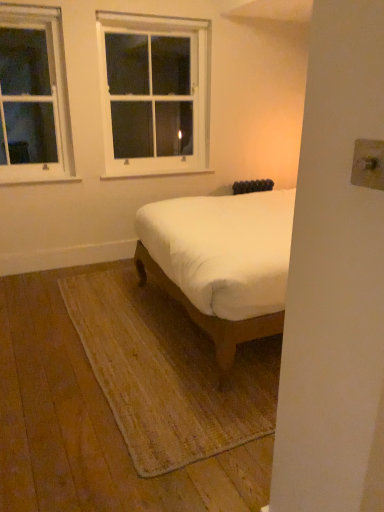
Image resolution: width=384 pixels, height=512 pixels. In order to click on white wood window at upper left, which is counted as the second window, starting from the right in this screenshot , I will do `click(34, 97)`.

Identify the location of white fabric bed at center. (221, 262).

Where is `white wood window at upper left, acting as the 1th window starting from the left`? Image resolution: width=384 pixels, height=512 pixels. white wood window at upper left, acting as the 1th window starting from the left is located at coordinates (34, 97).

Is white wood window at upper center, the first window from the right, facing away from white wood window at upper left, which is counted as the second window, starting from the right?

That's not correct — white wood window at upper center, the first window from the right, is not looking away from white wood window at upper left, which is counted as the second window, starting from the right.

I want to click on window behind the white wood window at upper left, acting as the 1th window starting from the left, so click(153, 93).

Can you confirm if white wood window at upper center, the 2th window positioned from the left, is shorter than white wood window at upper left, which is counted as the second window, starting from the right?

Incorrect, the height of white wood window at upper center, the 2th window positioned from the left, does not fall short of that of white wood window at upper left, which is counted as the second window, starting from the right.

Which object is further away from the camera taking this photo, white wood window at upper center, the first window from the right, or white wood window at upper left, which is counted as the second window, starting from the right?

Positioned behind is white wood window at upper center, the first window from the right.

Which object is positioned more to the left, white wood window at upper center, the 2th window positioned from the left, or white fabric bed at center?

From the viewer's perspective, white wood window at upper center, the 2th window positioned from the left, appears more on the left side.

Is white wood window at upper center, the 2th window positioned from the left, located outside white fabric bed at center?

Indeed, white wood window at upper center, the 2th window positioned from the left, is completely outside white fabric bed at center.

Locate an element on the screen. The height and width of the screenshot is (512, 384). window that is the 2nd object located behind the white fabric bed at center is located at coordinates (153, 93).

From a real-world perspective, relative to white fabric bed at center, is white wood window at upper center, the 2th window positioned from the left, vertically above or below?

Clearly, from a real-world perspective, white wood window at upper center, the 2th window positioned from the left, is above white fabric bed at center.

Which is less distant, (31, 61) or (282, 272)?

The point (282, 272) is in front.

Is white wood window at upper left, which is counted as the second window, starting from the right, not within white fabric bed at center?

white wood window at upper left, which is counted as the second window, starting from the right, lies outside white fabric bed at center's area.

Is white wood window at upper left, which is counted as the second window, starting from the right, bigger or smaller than white fabric bed at center?

white wood window at upper left, which is counted as the second window, starting from the right, is smaller than white fabric bed at center.

In the image, is white wood window at upper left, which is counted as the second window, starting from the right, positioned in front of or behind white fabric bed at center?

Clearly, white wood window at upper left, which is counted as the second window, starting from the right, is behind white fabric bed at center.

Is point (52, 118) behind point (121, 123)?

No, it is not.

Does white wood window at upper left, which is counted as the second window, starting from the right, have a smaller size compared to white wood window at upper center, the first window from the right?

Yes.

Can you confirm if white fabric bed at center is thinner than white wood window at upper center, the first window from the right?

A: In fact, white fabric bed at center might be wider than white wood window at upper center, the first window from the right.

Is white fabric bed at center positioned far away from white wood window at upper center, the first window from the right?

white fabric bed at center is far away from white wood window at upper center, the first window from the right.

Is white fabric bed at center taller than white wood window at upper center, the first window from the right?

No, white fabric bed at center is not taller than white wood window at upper center, the first window from the right.

From a real-world perspective, is white fabric bed at center physically located above or below white wood window at upper center, the 2th window positioned from the left?

white fabric bed at center is below white wood window at upper center, the 2th window positioned from the left.

Consider the image. Considering the sizes of objects white fabric bed at center and white wood window at upper left, which is counted as the second window, starting from the right, in the image provided, who is taller, white fabric bed at center or white wood window at upper left, which is counted as the second window, starting from the right,?

Standing taller between the two is white wood window at upper left, which is counted as the second window, starting from the right.

Is white fabric bed at center positioned far away from white wood window at upper left, acting as the 1th window starting from the left?

That's right, there is a large distance between white fabric bed at center and white wood window at upper left, acting as the 1th window starting from the left.

Would you say white fabric bed at center is outside white wood window at upper left, which is counted as the second window, starting from the right?

Yes, white fabric bed at center is located beyond the bounds of white wood window at upper left, which is counted as the second window, starting from the right.

The image size is (384, 512). What are the coordinates of `window lying on the right of white wood window at upper left, which is counted as the second window, starting from the right` in the screenshot? It's located at (153, 93).

Locate an element on the screen. the 2nd window above the white fabric bed at center (from the image's perspective) is located at coordinates (153, 93).

From the image, which object appears to be nearer to white wood window at upper left, which is counted as the second window, starting from the right, white fabric bed at center or white wood window at upper center, the first window from the right?

The object closer to white wood window at upper left, which is counted as the second window, starting from the right, is white wood window at upper center, the first window from the right.

Based on their spatial positions, is white wood window at upper center, the 2th window positioned from the left, or white fabric bed at center further from white wood window at upper left, which is counted as the second window, starting from the right?

The object further to white wood window at upper left, which is counted as the second window, starting from the right, is white fabric bed at center.

Estimate the real-world distances between objects in this image. Which object is further from white fabric bed at center, white wood window at upper center, the 2th window positioned from the left, or white wood window at upper left, which is counted as the second window, starting from the right?

white wood window at upper left, which is counted as the second window, starting from the right, is further to white fabric bed at center.

Looking at the image, which one is located further to white fabric bed at center, white wood window at upper left, which is counted as the second window, starting from the right, or white wood window at upper center, the 2th window positioned from the left?

white wood window at upper left, which is counted as the second window, starting from the right, is positioned further to the anchor white fabric bed at center.

From the image, which object appears to be nearer to white wood window at upper center, the 2th window positioned from the left, white fabric bed at center or white wood window at upper left, acting as the 1th window starting from the left?

white wood window at upper left, acting as the 1th window starting from the left, is positioned closer to the anchor white wood window at upper center, the 2th window positioned from the left.

Consider the image. Which object lies nearer to the anchor point white wood window at upper center, the first window from the right, white wood window at upper left, acting as the 1th window starting from the left, or white fabric bed at center?

white wood window at upper left, acting as the 1th window starting from the left, is positioned closer to the anchor white wood window at upper center, the first window from the right.

The height and width of the screenshot is (512, 384). What are the coordinates of `window between white wood window at upper left, which is counted as the second window, starting from the right, and white fabric bed at center from left to right` in the screenshot? It's located at (153, 93).